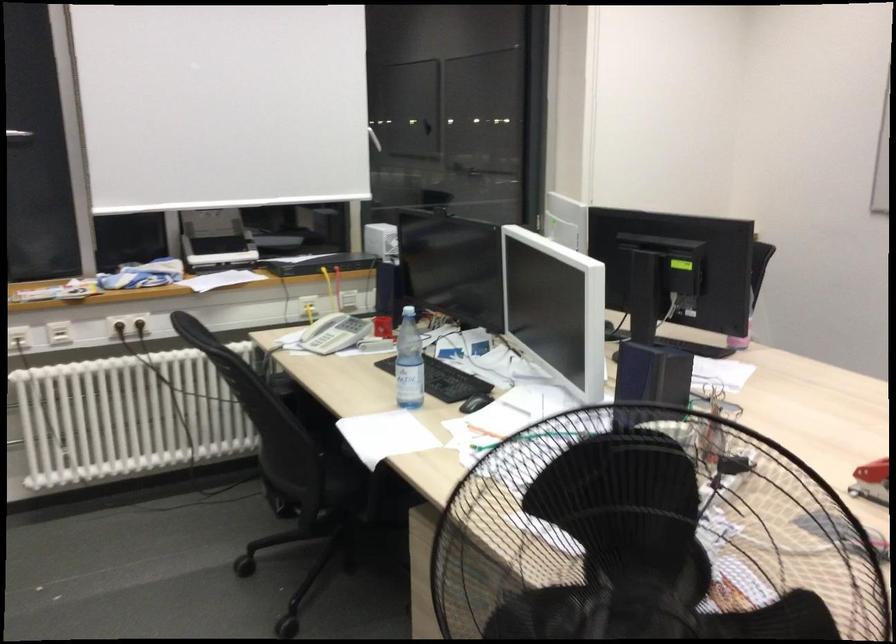
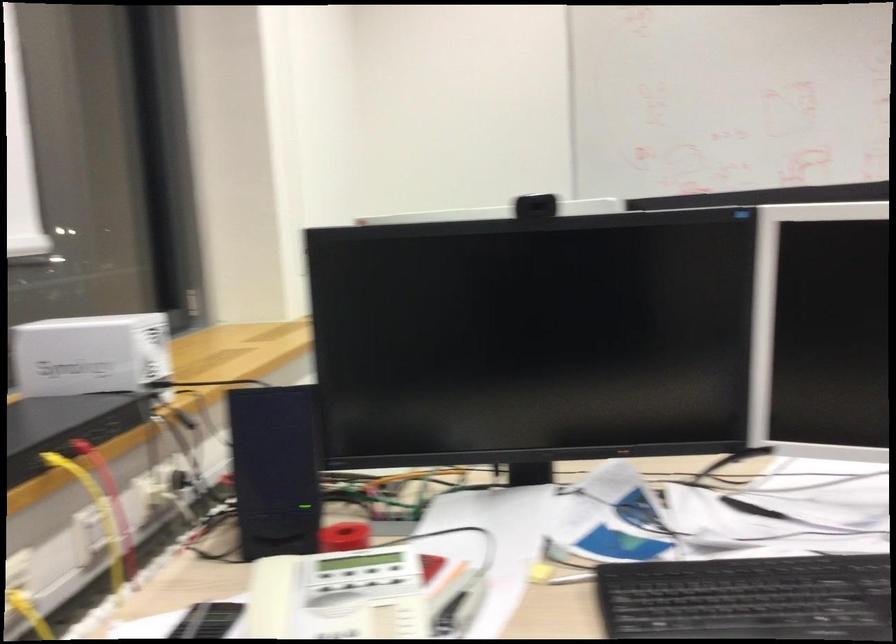
The point at (373, 232) is marked in the first image. Where is the corresponding point in the second image?

(90, 354)